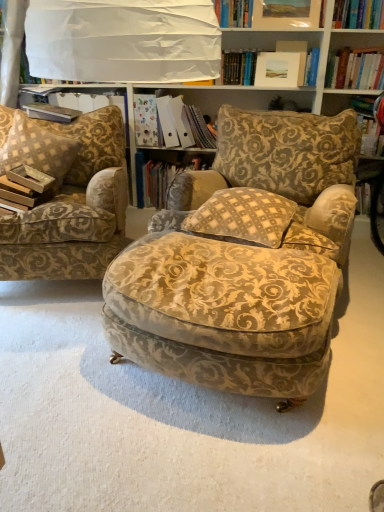
Question: Is hardcover book at center, which is counted as the 1th book, starting from the bottom, oriented away from matte paper folder at center, acting as the 1th book starting from the top?

Choices:
 (A) no
 (B) yes

Answer: (A)

Question: Is hardcover book at center, which is counted as the 1th book, starting from the bottom, in contact with matte paper folder at center, acting as the 1th book starting from the top?

Choices:
 (A) yes
 (B) no

Answer: (B)

Question: Considering the relative sizes of hardcover book at center, positioned as the 2th book in top-to-bottom order, and matte paper folder at center, positioned as the second book in bottom-to-top order, in the image provided, is hardcover book at center, positioned as the 2th book in top-to-bottom order, smaller than matte paper folder at center, positioned as the second book in bottom-to-top order,?

Choices:
 (A) yes
 (B) no

Answer: (A)

Question: Is hardcover book at center, which is counted as the 1th book, starting from the bottom, further to the viewer compared to matte paper folder at center, positioned as the second book in bottom-to-top order?

Choices:
 (A) no
 (B) yes

Answer: (B)

Question: From a real-world perspective, is hardcover book at center, positioned as the 2th book in top-to-bottom order, below matte paper folder at center, acting as the 1th book starting from the top?

Choices:
 (A) no
 (B) yes

Answer: (B)

Question: Considering the relative sizes of hardcover book at center, which is counted as the 1th book, starting from the bottom, and matte paper folder at center, acting as the 1th book starting from the top, in the image provided, is hardcover book at center, which is counted as the 1th book, starting from the bottom, shorter than matte paper folder at center, acting as the 1th book starting from the top,?

Choices:
 (A) yes
 (B) no

Answer: (A)

Question: From a real-world perspective, is matte white picture frame at upper center physically below gold-patterned fabric armchair at left, placed as the 1th chair when sorted from left to right?

Choices:
 (A) yes
 (B) no

Answer: (B)

Question: Considering the relative sizes of matte white picture frame at upper center and gold-patterned fabric armchair at left, placed as the 1th chair when sorted from left to right, in the image provided, is matte white picture frame at upper center wider than gold-patterned fabric armchair at left, placed as the 1th chair when sorted from left to right,?

Choices:
 (A) no
 (B) yes

Answer: (A)

Question: Is matte white picture frame at upper center turned away from gold-patterned fabric armchair at left, placed as the 1th chair when sorted from left to right?

Choices:
 (A) yes
 (B) no

Answer: (B)

Question: From the image's perspective, is matte white picture frame at upper center over gold-patterned fabric armchair at left, positioned as the 2th chair in right-to-left order?

Choices:
 (A) no
 (B) yes

Answer: (B)

Question: Is matte white picture frame at upper center taller than gold-patterned fabric armchair at left, positioned as the 2th chair in right-to-left order?

Choices:
 (A) yes
 (B) no

Answer: (B)

Question: Is gold-patterned fabric armchair at left, positioned as the 2th chair in right-to-left order, inside matte white picture frame at upper center?

Choices:
 (A) no
 (B) yes

Answer: (A)

Question: Considering the relative sizes of beige checkered pillow at center, the 1th pillow when ordered from front to back, and hardcover book at upper left in the image provided, is beige checkered pillow at center, the 1th pillow when ordered from front to back, shorter than hardcover book at upper left?

Choices:
 (A) yes
 (B) no

Answer: (B)